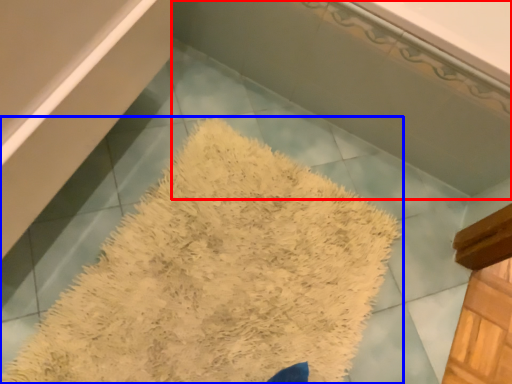
Question: Which object is closer to the camera taking this photo, bath (highlighted by a red box) or bath mat (highlighted by a blue box)?

Choices:
 (A) bath
 (B) bath mat

Answer: (B)